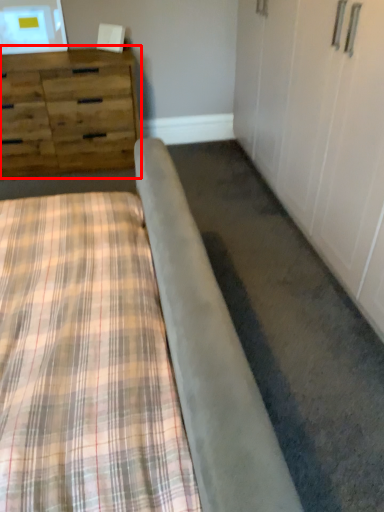
Question: Considering the relative positions of chest of drawers (annotated by the red box) and bed in the image provided, where is chest of drawers (annotated by the red box) located with respect to the staircase?

Choices:
 (A) left
 (B) right

Answer: (A)